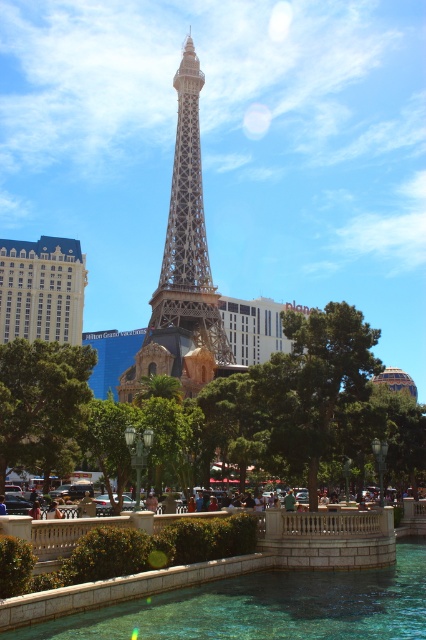
You are standing in the Las Vegas Strip near the Eiffel Tower replica and want to take a photo. There are two points marked in the scene. The first point is at coordinates point [241,586] and the second point is at point [196,324]. Which of these two points is closer to you?

Point [241,586] is closer to the viewer than point [196,324].